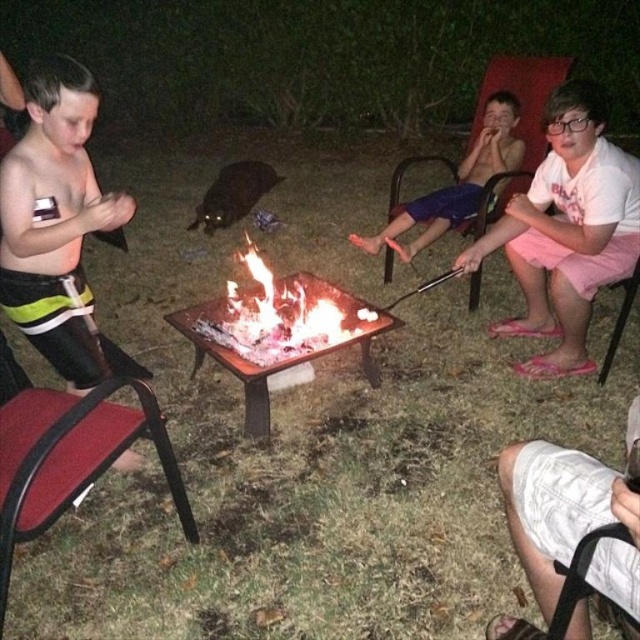
Question: Does black matte shorts at left appear on the left side of white cotton shorts at lower right?

Choices:
 (A) yes
 (B) no

Answer: (A)

Question: Which object appears farthest from the camera in this image?

Choices:
 (A) blue shorts at center
 (B) white cotton shorts at lower right
 (C) black matte shorts at left

Answer: (A)

Question: From the image, what is the correct spatial relationship of white cotton shorts at lower right in relation to blue shorts at center?

Choices:
 (A) below
 (B) above

Answer: (A)

Question: Which point is closer to the camera?

Choices:
 (A) white cotton shorts at lower right
 (B) blue shorts at center

Answer: (A)

Question: Which point is farther to the camera?

Choices:
 (A) (64, 227)
 (B) (428, 211)
 (C) (570, 449)
 (D) (513, 182)

Answer: (D)

Question: Is the position of black matte shorts at left more distant than that of pink fabric chair at upper right?

Choices:
 (A) yes
 (B) no

Answer: (B)